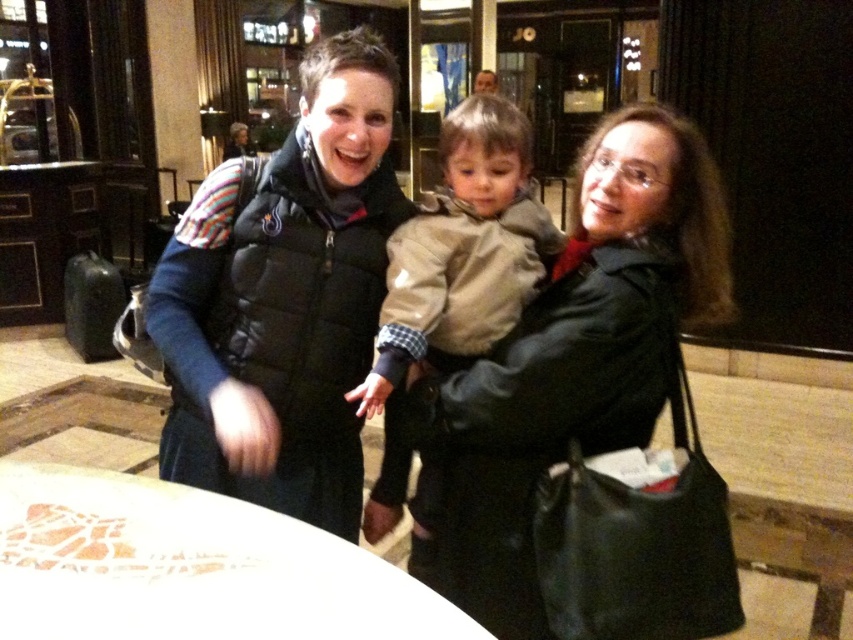
Who is shorter, black puffer vest at center or tan fabric jacket at center?

With less height is tan fabric jacket at center.

Is the position of black puffer vest at center more distant than that of tan fabric jacket at center?

No, black puffer vest at center is closer to the viewer.

Image resolution: width=853 pixels, height=640 pixels. What do you see at coordinates (283, 300) in the screenshot? I see `black puffer vest at center` at bounding box center [283, 300].

You are a GUI agent. You are given a task and a screenshot of the screen. Output one action in this format:
    pyautogui.click(x=<x>, y=<y>)
    Task: Click on the black puffer vest at center
    
    Given the screenshot: What is the action you would take?
    pyautogui.click(x=283, y=300)

Does matte black coat at center lie in front of smooth brown hair at upper center?

Yes, it is in front of smooth brown hair at upper center.

Is matte black coat at center to the right of smooth brown hair at upper center from the viewer's perspective?

In fact, matte black coat at center is to the left of smooth brown hair at upper center.

Is point (552, 364) positioned behind point (474, 86)?

No.

You are a GUI agent. You are given a task and a screenshot of the screen. Output one action in this format:
    pyautogui.click(x=<x>, y=<y>)
    Task: Click on the matte black coat at center
    
    Given the screenshot: What is the action you would take?
    pyautogui.click(x=573, y=358)

What do you see at coordinates (283, 300) in the screenshot? The width and height of the screenshot is (853, 640). I see `black puffer vest at center` at bounding box center [283, 300].

Who is lower down, black puffer vest at center or smooth brown hair at upper center?

Positioned lower is black puffer vest at center.

Where is `black puffer vest at center`? The width and height of the screenshot is (853, 640). black puffer vest at center is located at coordinates (283, 300).

Find the location of `black puffer vest at center`. black puffer vest at center is located at coordinates (283, 300).